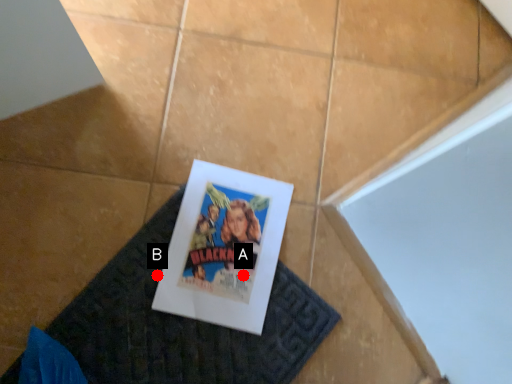
Question: Two points are circled on the image, labeled by A and B beside each circle. Which point appears farthest from the camera in this image?

Choices:
 (A) A is further
 (B) B is further

Answer: (A)